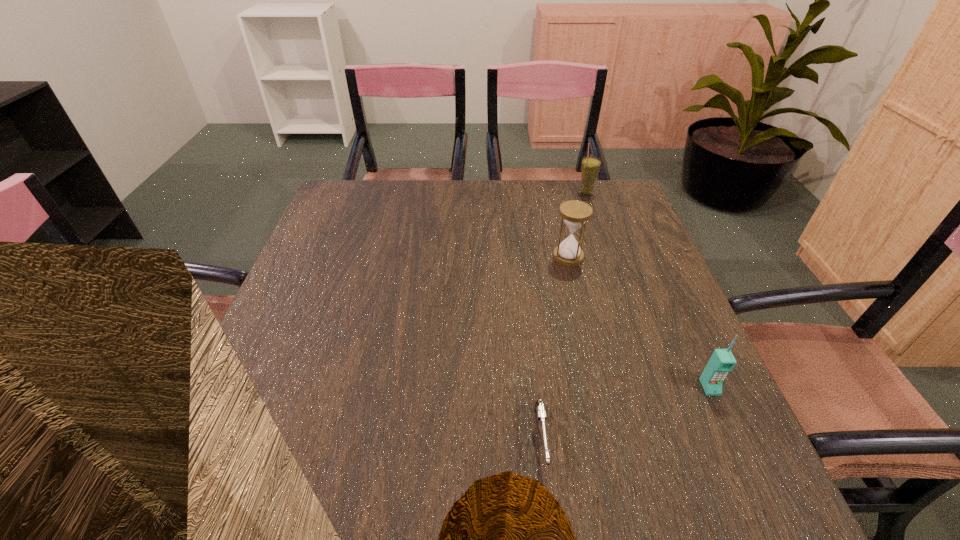
This screenshot has width=960, height=540. I want to click on free space located on the keypad of the second nearest object, so click(732, 435).

I want to click on object located at the far edge, so click(x=590, y=166).

This screenshot has height=540, width=960. Identify the location of object located at the near edge. (540, 409).

Find the location of a particular element. straw for drinking that is at the right edge is located at coordinates (590, 166).

Find the location of a particular element. This screenshot has width=960, height=540. cellular telephone present at the right edge is located at coordinates (722, 361).

Where is `object located at the far right corner`? This screenshot has width=960, height=540. object located at the far right corner is located at coordinates (590, 166).

Locate an element on the screen. This screenshot has width=960, height=540. free location at the far edge of the desktop is located at coordinates (456, 203).

The width and height of the screenshot is (960, 540). I want to click on free space at the near edge of the desktop, so click(317, 470).

Where is `blank area at the left edge`? Image resolution: width=960 pixels, height=540 pixels. blank area at the left edge is located at coordinates (345, 306).

In the image, there is a desktop. Where is `vacant space at the right edge`? The width and height of the screenshot is (960, 540). vacant space at the right edge is located at coordinates (664, 331).